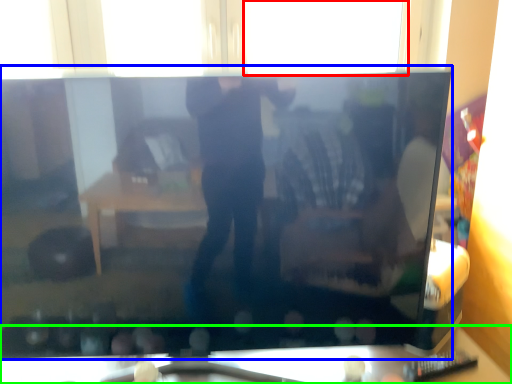
Question: Based on their relative distances, which object is farther from window (highlighted by a red box)? Choose from television (highlighted by a blue box) and furniture (highlighted by a green box).

Choices:
 (A) television
 (B) furniture

Answer: (B)